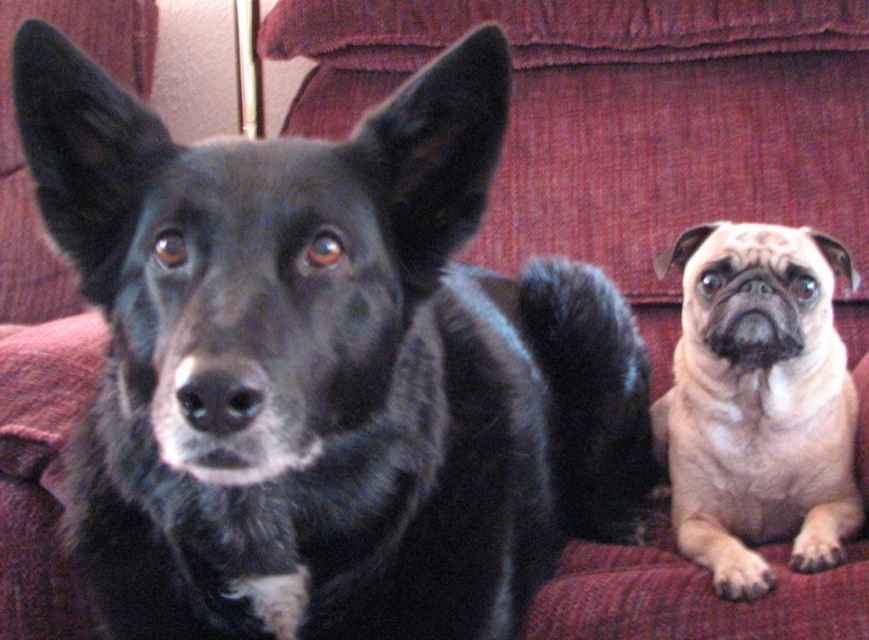
Can you confirm if black fur dog at center is positioned below beige fur pug at right?

Indeed, black fur dog at center is positioned under beige fur pug at right.

Identify the location of black fur dog at center. Image resolution: width=869 pixels, height=640 pixels. (324, 368).

Identify the location of black fur dog at center. (324, 368).